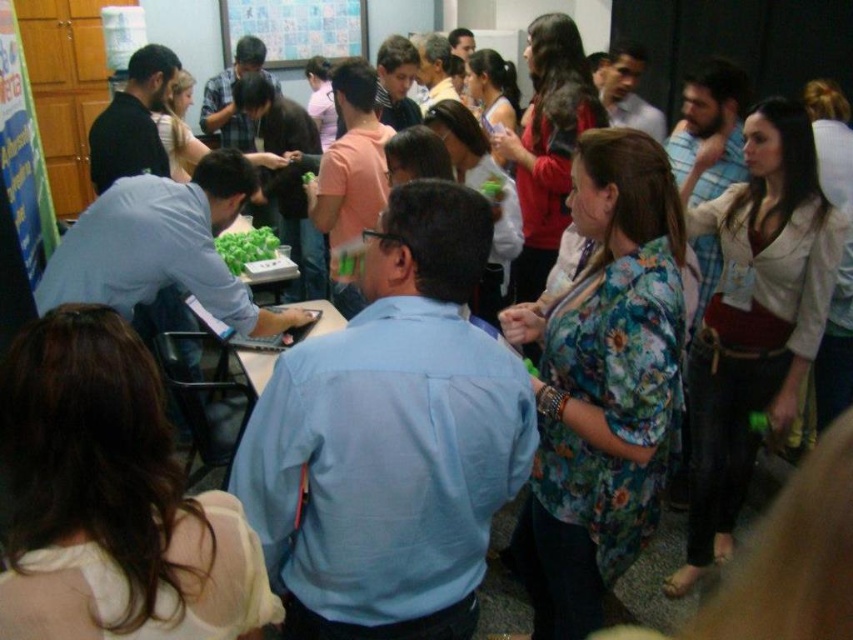
Who is taller, floral fabric blouse at right or green leafy vegetables at center?

Standing taller between the two is floral fabric blouse at right.

Which is behind, point (781, 259) or point (262, 244)?

The point (262, 244) is more distant.

Where is `floral fabric blouse at right`? floral fabric blouse at right is located at coordinates (753, 316).

Between point (270, 45) and point (235, 248), which one is positioned behind?

Point (270, 45)

Between white paperboard at upper center and green leafy vegetables at center, which one has less height?

green leafy vegetables at center is shorter.

Find the location of a particular element. white paperboard at upper center is located at coordinates (294, 28).

Is floral fabric blouse at right to the left of white paperboard at upper center from the viewer's perspective?

In fact, floral fabric blouse at right is to the right of white paperboard at upper center.

Is point (775, 365) closer to camera compared to point (305, 17)?

Yes.

The image size is (853, 640). Identify the location of floral fabric blouse at right. (753, 316).